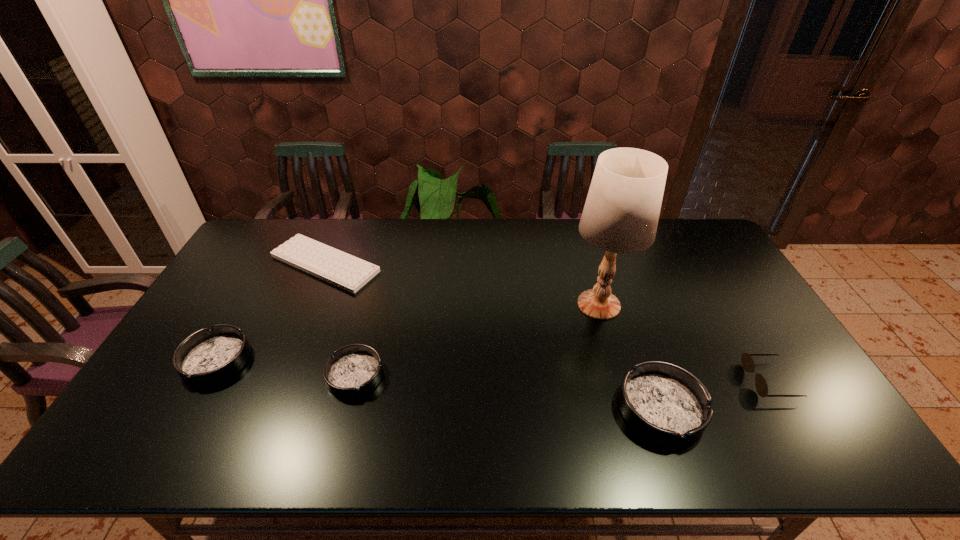
You are a GUI agent. You are given a task and a screenshot of the screen. Output one action in this format:
    pyautogui.click(x=<x>, y=<y>)
    Task: Click on the object located in the far left corner section of the desktop
    The width and height of the screenshot is (960, 540).
    Given the screenshot: What is the action you would take?
    pyautogui.click(x=348, y=272)

This screenshot has width=960, height=540. I want to click on object at the near left corner, so click(207, 357).

This screenshot has width=960, height=540. Find the location of `object at the near right corner`. object at the near right corner is located at coordinates (747, 362).

Find the location of `free location at the far edge of the desktop`. free location at the far edge of the desktop is located at coordinates (530, 227).

The height and width of the screenshot is (540, 960). In the image, there is a desktop. What are the coordinates of `vacant region at the left edge` in the screenshot? It's located at (231, 278).

Find the location of a particular element. This screenshot has width=960, height=540. free space at the right edge of the desktop is located at coordinates (714, 295).

I want to click on vacant space at the near right corner of the desktop, so click(792, 395).

The width and height of the screenshot is (960, 540). In order to click on unoccupied area between the tallest object and the sunglasses in this screenshot , I will do `click(684, 343)`.

I want to click on unoccupied area between the shortest object and the tallest object, so click(462, 284).

Locate an element on the screen. The height and width of the screenshot is (540, 960). vacant space that is in between the sunglasses and the rightmost ashtray is located at coordinates (715, 395).